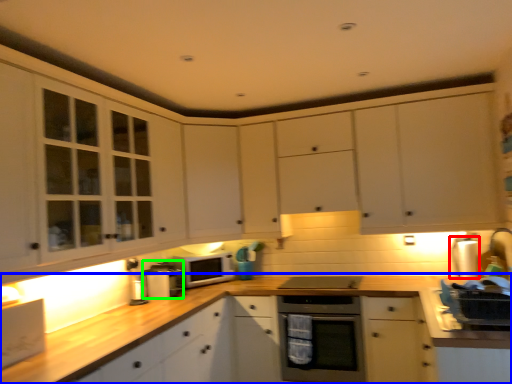
Question: Based on their relative distances, which object is nearer to appliance (highlighted by a red box)? Choose from countertop (highlighted by a blue box) and appliance (highlighted by a green box).

Choices:
 (A) countertop
 (B) appliance

Answer: (A)